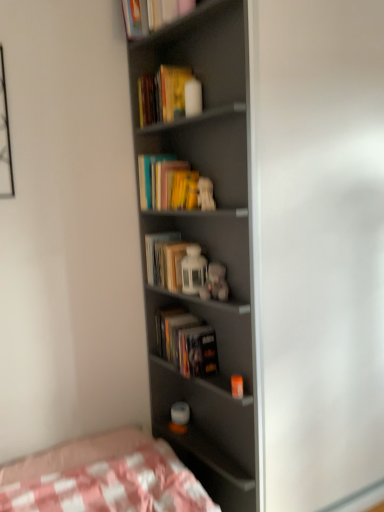
Question: Is hardcover book at center, arranged as the second paperback book when ordered from the bottom, looking in the opposite direction of hardcover book at center, arranged as the 1th paperback book when ordered from the bottom?

Choices:
 (A) no
 (B) yes

Answer: (A)

Question: From a real-world perspective, is hardcover book at center, arranged as the second paperback book when ordered from the bottom, on hardcover book at center, which appears as the 4th paperback book when viewed from the top?

Choices:
 (A) yes
 (B) no

Answer: (A)

Question: Is hardcover book at center, arranged as the second paperback book when ordered from the bottom, completely or partially outside of hardcover book at center, which appears as the 4th paperback book when viewed from the top?

Choices:
 (A) no
 (B) yes

Answer: (B)

Question: Does hardcover book at center, which is the third paperback book from top to bottom, turn towards hardcover book at center, arranged as the 1th paperback book when ordered from the bottom?

Choices:
 (A) yes
 (B) no

Answer: (B)

Question: Is hardcover book at center, arranged as the second paperback book when ordered from the bottom, at the left side of hardcover book at center, arranged as the 1th paperback book when ordered from the bottom?

Choices:
 (A) no
 (B) yes

Answer: (B)

Question: From the image's perspective, is hardcover book at center, which is the third paperback book from top to bottom, beneath hardcover book at center, arranged as the 1th paperback book when ordered from the bottom?

Choices:
 (A) no
 (B) yes

Answer: (A)

Question: Is fluffy white teddy bear at center, which appears as the third toy when viewed from the top, behind matte gray screen door at center?

Choices:
 (A) yes
 (B) no

Answer: (A)

Question: Is the surface of fluffy white teddy bear at center, which appears as the third toy when viewed from the top, in direct contact with matte gray screen door at center?

Choices:
 (A) no
 (B) yes

Answer: (A)

Question: Is fluffy white teddy bear at center, which appears as the third toy when viewed from the top, positioned with its back to matte gray screen door at center?

Choices:
 (A) no
 (B) yes

Answer: (B)

Question: Is fluffy white teddy bear at center, which appears as the third toy when viewed from the top, wider than matte gray screen door at center?

Choices:
 (A) no
 (B) yes

Answer: (A)

Question: Can you confirm if fluffy white teddy bear at center, the 1th toy from the bottom, is positioned to the right of matte gray screen door at center?

Choices:
 (A) yes
 (B) no

Answer: (B)

Question: From the image's perspective, is fluffy white teddy bear at center, the 1th toy from the bottom, over matte gray screen door at center?

Choices:
 (A) no
 (B) yes

Answer: (A)

Question: Can you confirm if hardcover book at center, arranged as the 1th paperback book when ordered from the bottom, is bigger than matte gray bookcase at center?

Choices:
 (A) yes
 (B) no

Answer: (B)